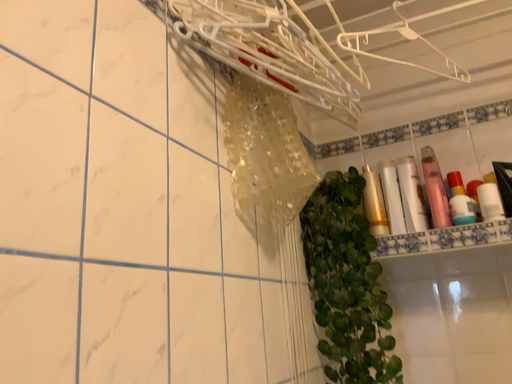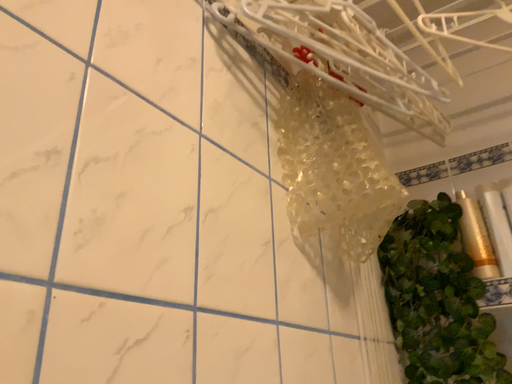
Question: How did the camera likely rotate when shooting the video?

Choices:
 (A) rotated downward
 (B) rotated upward

Answer: (B)